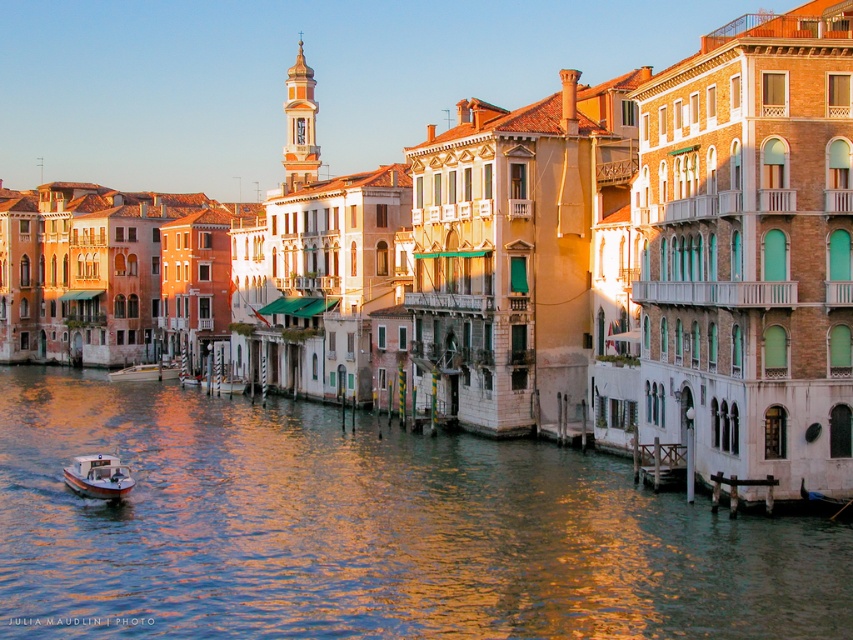
You are a tourist planning to rent a boat to navigate the canal. You notice the white plastic boat at lower left and the wooden boat at center. Which boat would be more suitable for carrying a family of four with luggage?

The wooden boat at center is more suitable for carrying a family of four with luggage because it has a larger size compared to the white plastic boat at lower left.